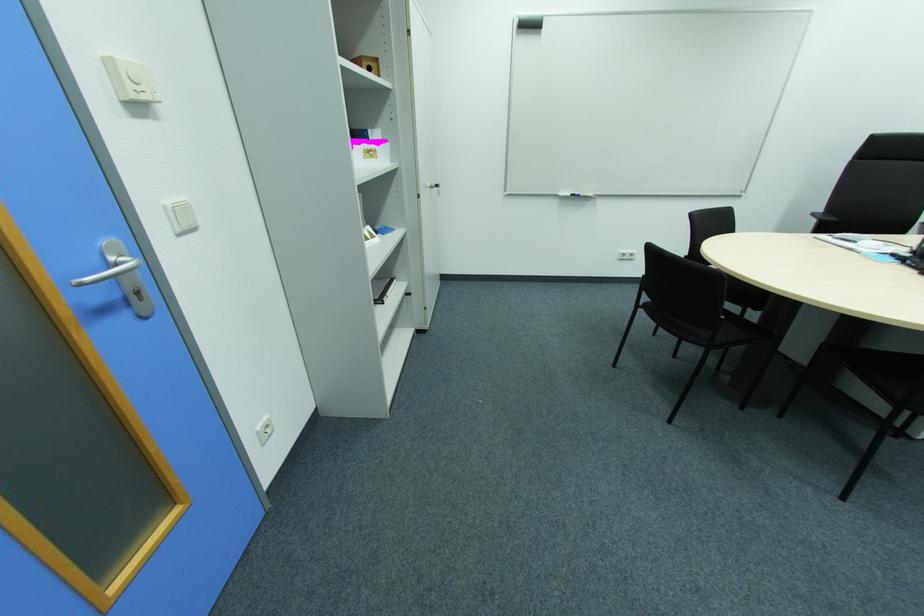
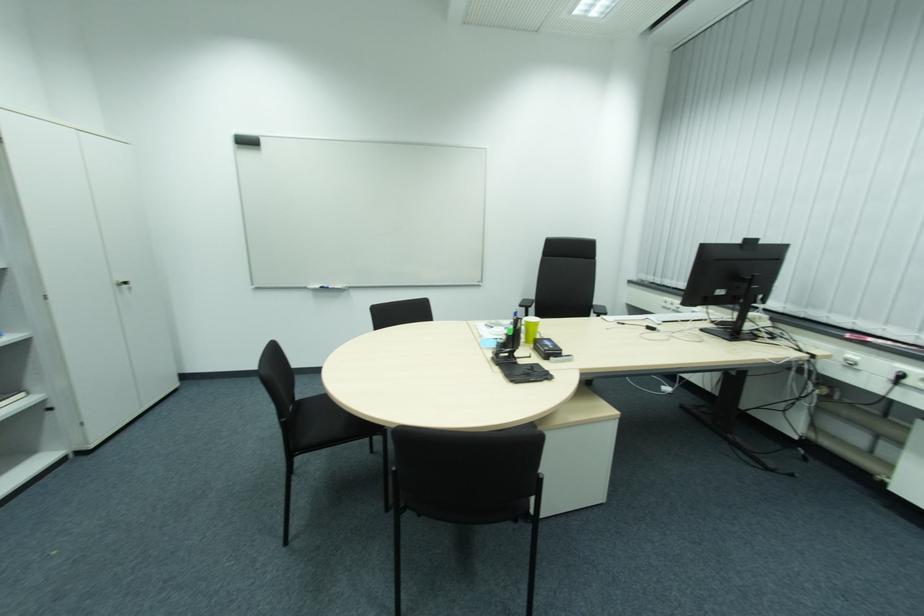
Question: What movement of the cameraman would produce the second image?

Choices:
 (A) Left
 (B) Right
 (C) Forward
 (D) Backward

Answer: (B)